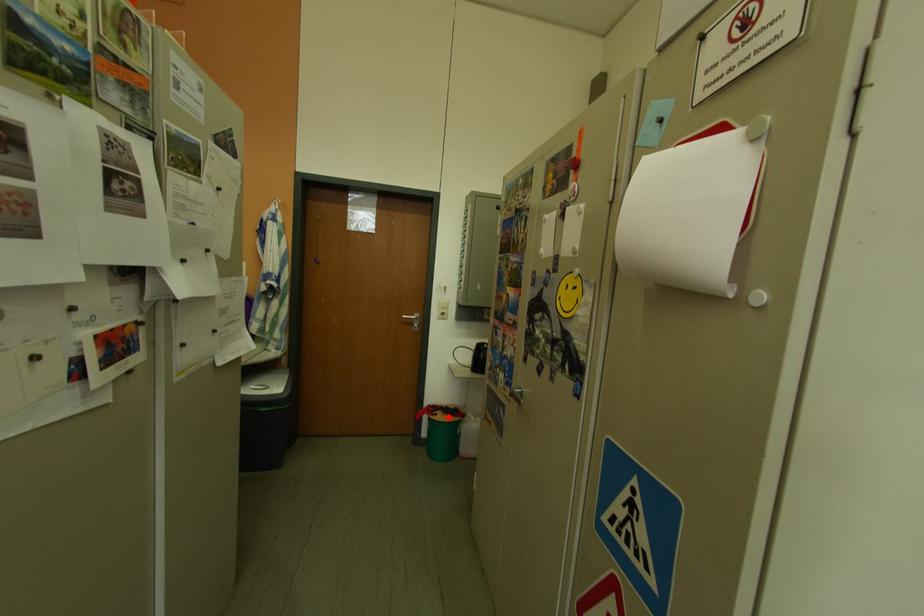
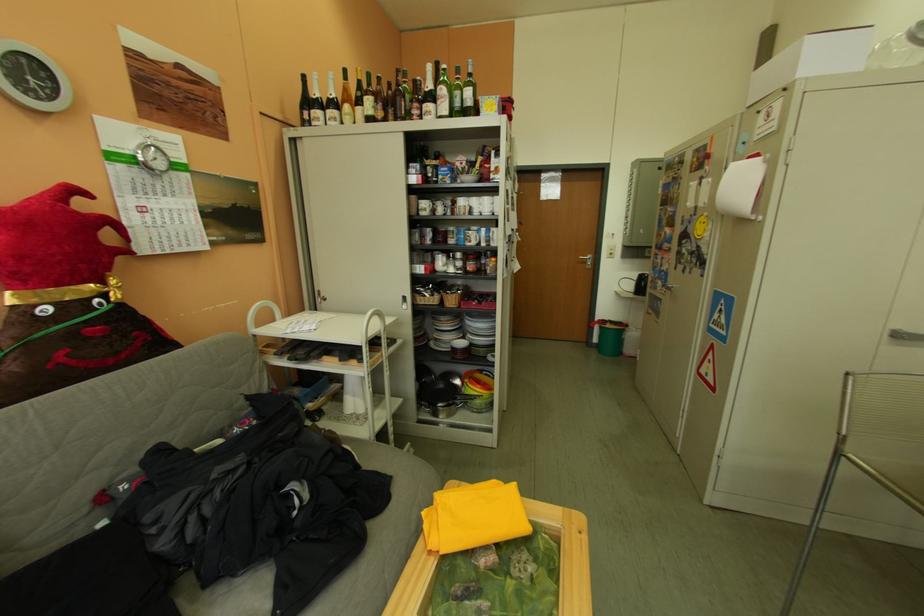
In the second image, find the point that corresponds to the highlighted location in the first image.

(617, 326)